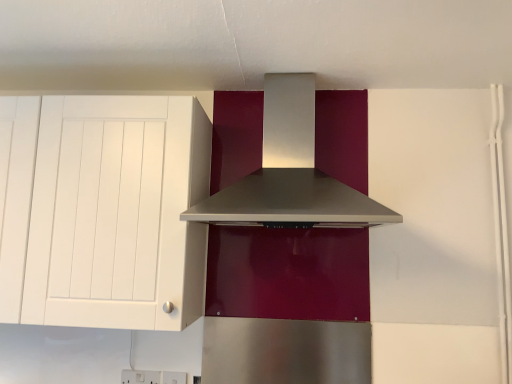
Locate an element on the screen. satin silver range hood at center is located at coordinates (290, 173).

What is the approximate width of satin silver range hood at center?

The width of satin silver range hood at center is 19.06 inches.

This screenshot has width=512, height=384. Describe the element at coordinates (290, 173) in the screenshot. I see `satin silver range hood at center` at that location.

Describe the element at coordinates (113, 213) in the screenshot. I see `white matte cabinet at left` at that location.

Where is `white matte cabinet at left`? white matte cabinet at left is located at coordinates (113, 213).

Where is `satin silver range hood at center`? The width and height of the screenshot is (512, 384). satin silver range hood at center is located at coordinates (290, 173).

Would you say satin silver range hood at center is to the left or to the right of white matte cabinet at left in the picture?

satin silver range hood at center is positioned on white matte cabinet at left's right side.

In the image, is satin silver range hood at center positioned in front of or behind white matte cabinet at left?

Clearly, satin silver range hood at center is in front of white matte cabinet at left.

Does point (267, 150) appear closer or farther from the camera than point (55, 265)?

Point (267, 150) is farther from the camera than point (55, 265).

From the image's perspective, which one is positioned lower, satin silver range hood at center or white matte cabinet at left?

white matte cabinet at left is shown below in the image.

From a real-world perspective, which object stands above the other?

In real-world perspective, satin silver range hood at center is above.

Is satin silver range hood at center wider than white matte cabinet at left?

Yes, satin silver range hood at center is wider than white matte cabinet at left.

Between satin silver range hood at center and white matte cabinet at left, which one has less height?

With less height is satin silver range hood at center.

Which of these two, satin silver range hood at center or white matte cabinet at left, is bigger?

With larger size is white matte cabinet at left.

Would you say satin silver range hood at center is inside or outside white matte cabinet at left?

satin silver range hood at center is not inside white matte cabinet at left, it's outside.

Would you consider satin silver range hood at center to be distant from white matte cabinet at left?

satin silver range hood at center is actually quite close to white matte cabinet at left.

Is satin silver range hood at center facing away from white matte cabinet at left?

satin silver range hood at center is not turned away from white matte cabinet at left.

Can you tell me how much satin silver range hood at center and white matte cabinet at left differ in facing direction?

The facing directions of satin silver range hood at center and white matte cabinet at left are 1.49 degrees apart.

In the image, there is a white matte cabinet at left. What are the coordinates of `home appliance above it (from the image's perspective)` in the screenshot? It's located at (290, 173).

Is white matte cabinet at left at the left side of satin silver range hood at center?

Yes, white matte cabinet at left is to the left of satin silver range hood at center.

Considering their positions, is white matte cabinet at left located in front of or behind satin silver range hood at center?

white matte cabinet at left is behind satin silver range hood at center.

From the picture: Which point is more distant from viewer, (164, 157) or (275, 101)?

Positioned behind is point (275, 101).

Looking at this image, from the image's perspective, is white matte cabinet at left above satin silver range hood at center?

Actually, white matte cabinet at left appears below satin silver range hood at center in the image.

From a real-world perspective, between white matte cabinet at left and satin silver range hood at center, who is vertically lower?

white matte cabinet at left, from a real-world perspective.

Consider the image. Which object is wider, white matte cabinet at left or satin silver range hood at center?

Wider between the two is satin silver range hood at center.

Who is shorter, white matte cabinet at left or satin silver range hood at center?

satin silver range hood at center is shorter.

Between white matte cabinet at left and satin silver range hood at center, which one has larger size?

With larger size is white matte cabinet at left.

Is white matte cabinet at left completely or partially outside of satin silver range hood at center?

Yes.

Can you see white matte cabinet at left touching satin silver range hood at center?

No, white matte cabinet at left is not making contact with satin silver range hood at center.

Is white matte cabinet at left turned away from satin silver range hood at center?

white matte cabinet at left is not turned away from satin silver range hood at center.

This screenshot has width=512, height=384. I want to click on home appliance above the white matte cabinet at left (from a real-world perspective), so click(x=290, y=173).

At what (x,y) coordinates should I click in order to perform the action: click on home appliance on the right of white matte cabinet at left. Please return your answer as a coordinate pair (x, y). The height and width of the screenshot is (384, 512). Looking at the image, I should click on (290, 173).

Identify the location of cabinetry below the satin silver range hood at center (from the image's perspective). The height and width of the screenshot is (384, 512). (113, 213).